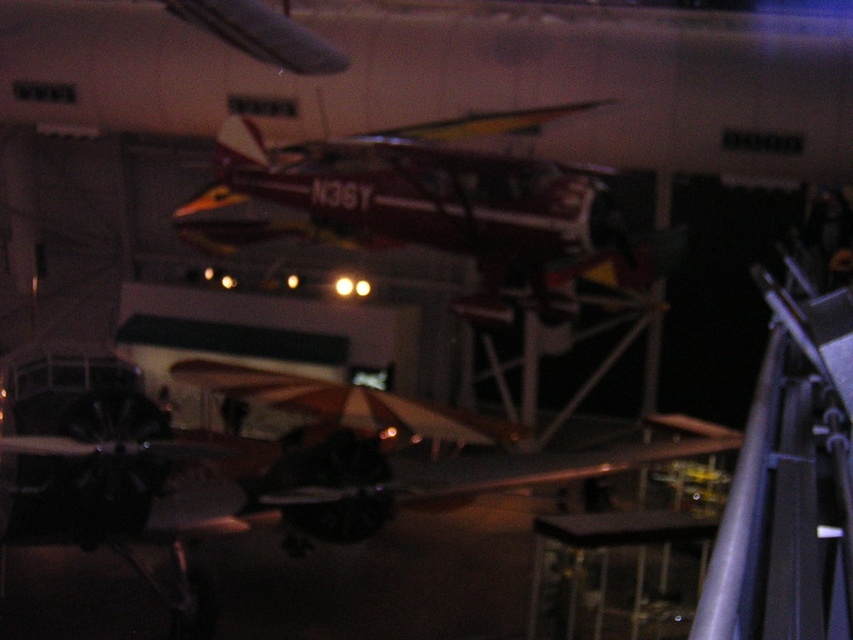
You are a visitor at the aviation museum and want to take a photo of both the shiny silver airplane at center and the shiny metallic airplane at center. Which one should you focus on first to ensure it appears larger in your photo?

You should focus on the shiny silver airplane at center first because it is closer to you than the shiny metallic airplane at center, making it appear larger in the photo.

You are an aviation enthusiast visiting the museum and want to compare the two airplanes displayed. Which airplane has a greater width between the shiny silver airplane at center and the shiny metallic airplane at center?

The shiny silver airplane at center has a greater width than the shiny metallic airplane at center according to the description.